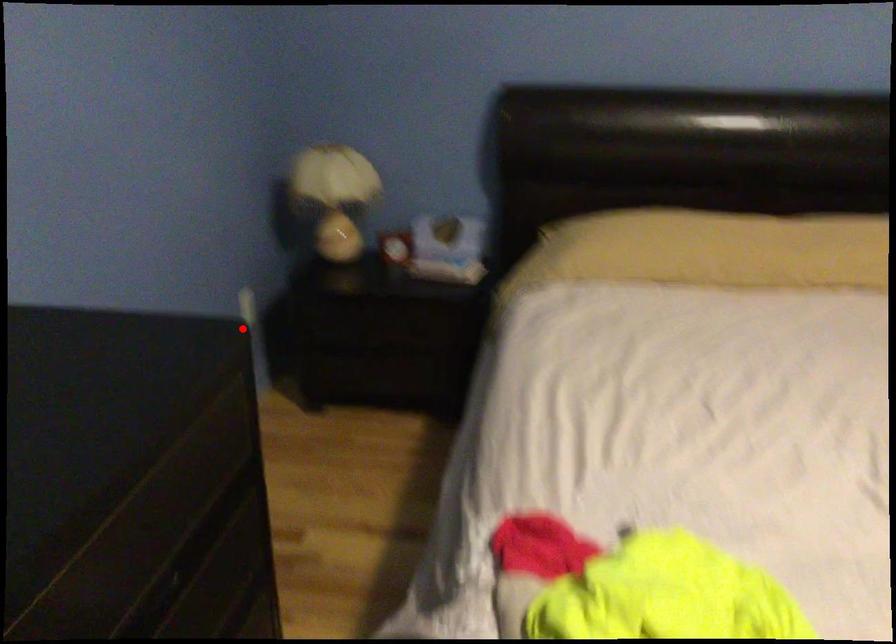
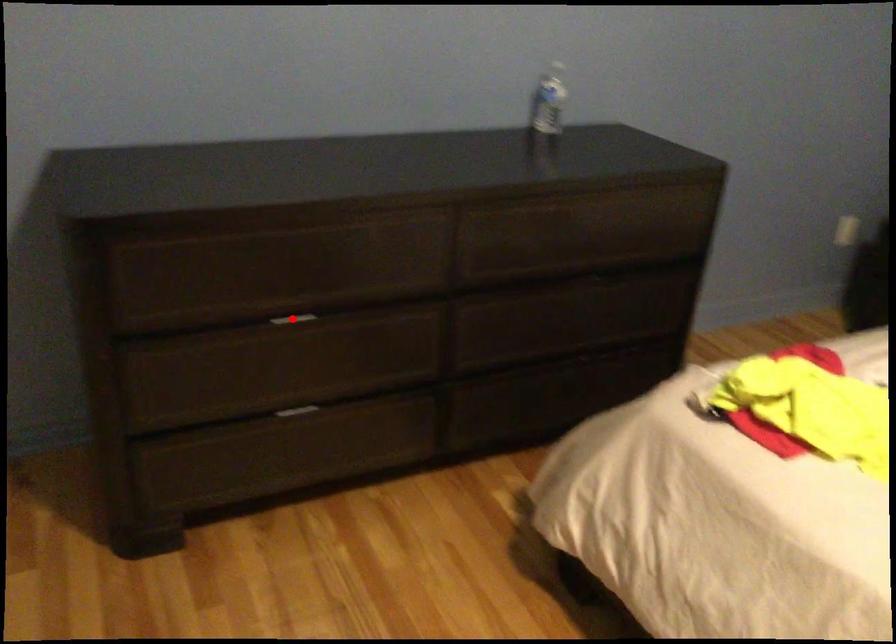
I am providing you with two images of the same scene from different viewpoints. A red point is marked on the first image and another point is marked on the second image. Does the point marked in image1 correspond to the same location as the one in image2?

No